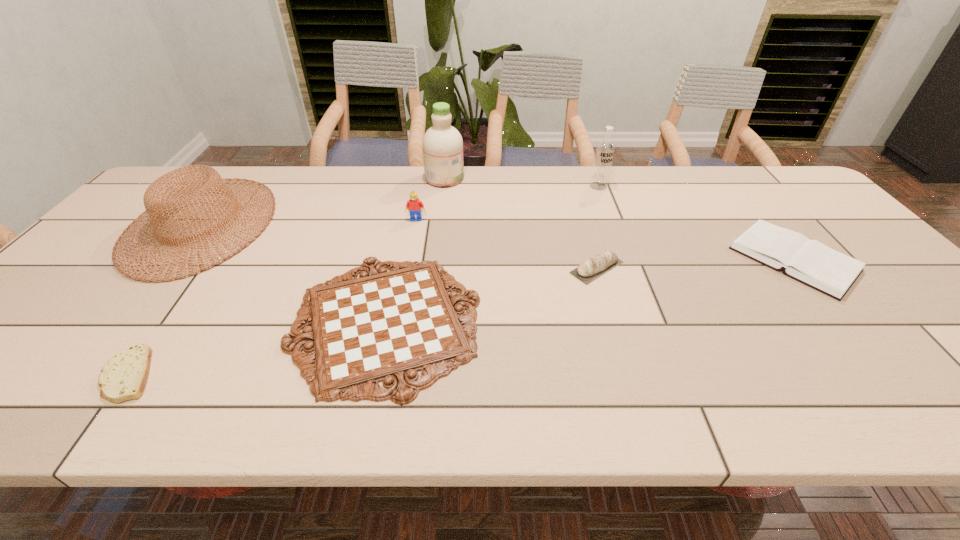
The height and width of the screenshot is (540, 960). Identify the location of the tallest object. click(442, 143).

You are a GUI agent. You are given a task and a screenshot of the screen. Output one action in this format:
    pyautogui.click(x=<x>, y=<y>)
    Task: Click on the second tallest object
    The height and width of the screenshot is (540, 960).
    Given the screenshot: What is the action you would take?
    pyautogui.click(x=604, y=153)

This screenshot has width=960, height=540. I want to click on the sixth shortest object, so click(169, 201).

The height and width of the screenshot is (540, 960). In order to click on Lego in this screenshot , I will do `click(414, 205)`.

Locate an element on the screen. The height and width of the screenshot is (540, 960). the taller pita bread is located at coordinates (588, 270).

You are a GUI agent. You are given a task and a screenshot of the screen. Output one action in this format:
    pyautogui.click(x=<x>, y=<y>)
    Task: Click on the right pita bread
    This screenshot has height=540, width=960.
    Given the screenshot: What is the action you would take?
    pyautogui.click(x=588, y=270)

This screenshot has width=960, height=540. In order to click on the third shortest object in this screenshot , I will do `click(810, 262)`.

This screenshot has height=540, width=960. Identify the location of the rightmost object. (810, 262).

This screenshot has width=960, height=540. I want to click on chessboard, so pyautogui.click(x=384, y=326).

Identify the location of the left pita bread. The height and width of the screenshot is (540, 960). (124, 376).